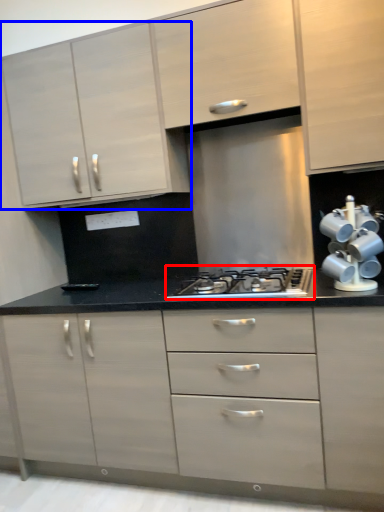
Question: Which object is closer to the camera taking this photo, gas stove (highlighted by a red box) or cabinetry (highlighted by a blue box)?

Choices:
 (A) gas stove
 (B) cabinetry

Answer: (A)